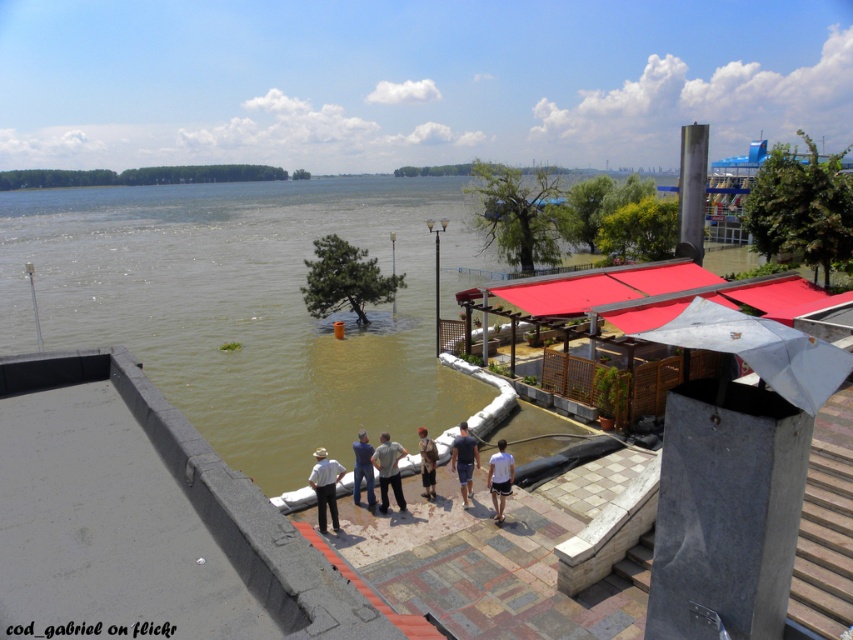
You are a delivery person trying to reach a customer located at point 0.478, 0.291. The brown muddy water at center is blocking your path. Can you detour around it? Please explain your reasoning based on the scene description.

The brown muddy water at center is located at point (247, 305), which is exactly where the customer is. Therefore, the path is completely blocked by the brown muddy water at center, so you cannot reach the customer without going through the water.

You are a hiker who needs to cross the area where the brown muddy water at center and denim shorts at center are located. The path is narrow. Can you safely walk between them?

The brown muddy water at center is 74.05 meters away from the denim shorts at center, so there is sufficient space to walk between them safely.

In the scene shown: You are standing at the edge of the flooded area and want to reach the point marked as point [341,236] and point [466,483]. Which point is closer to you?

Point [341,236] is closer to you because it is further to the viewer than point [466,483].